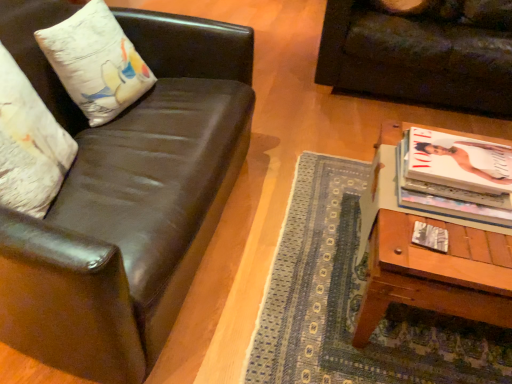
You are a GUI agent. You are given a task and a screenshot of the screen. Output one action in this format:
    pyautogui.click(x=<x>, y=<y>)
    Task: Click on the vacant area that is in front of white glossy magazine at right
    
    Given the screenshot: What is the action you would take?
    pyautogui.click(x=455, y=248)